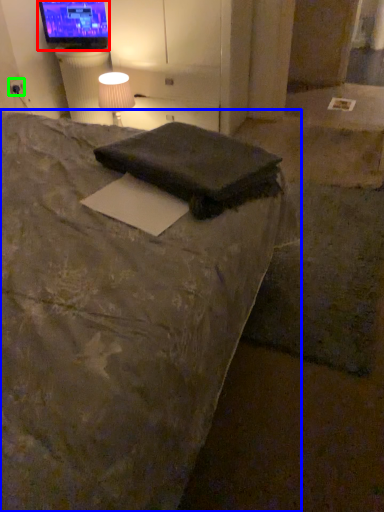
Question: Which object is positioned farthest from television (highlighted by a red box)? Select from bed (highlighted by a blue box) and electric outlet (highlighted by a green box).

Choices:
 (A) bed
 (B) electric outlet

Answer: (A)